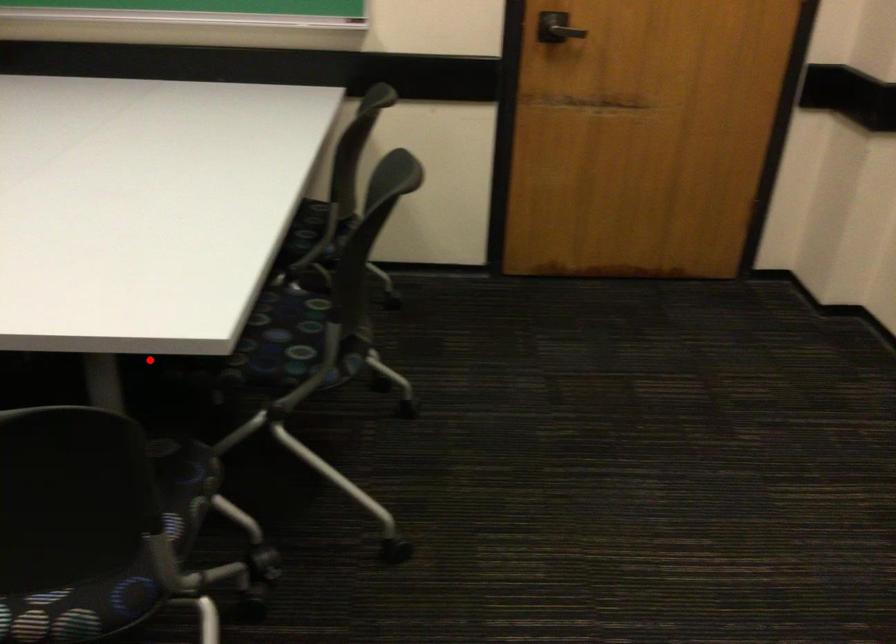
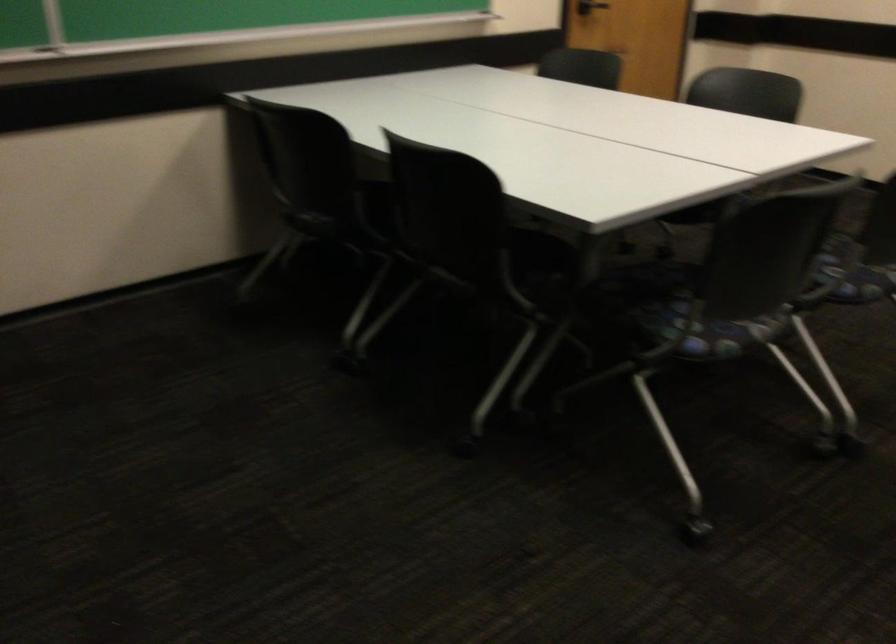
Question: I am providing you with two images of the same scene from different viewpoints. A red point is shown in image1. For the corresponding object point in image2, is it positioned nearer or farther from the camera?

Choices:
 (A) Nearer
 (B) Farther

Answer: (B)